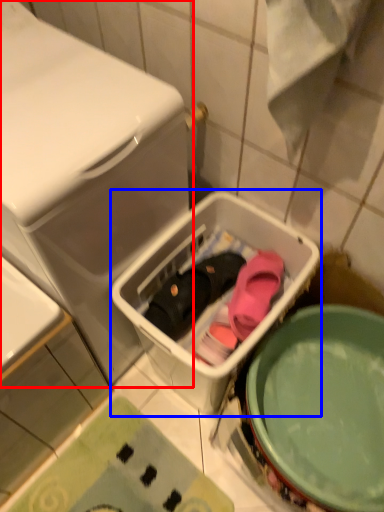
Question: Which object is closer to the camera taking this photo, dish washer (highlighted by a red box) or dish washer (highlighted by a blue box)?

Choices:
 (A) dish washer
 (B) dish washer

Answer: (A)